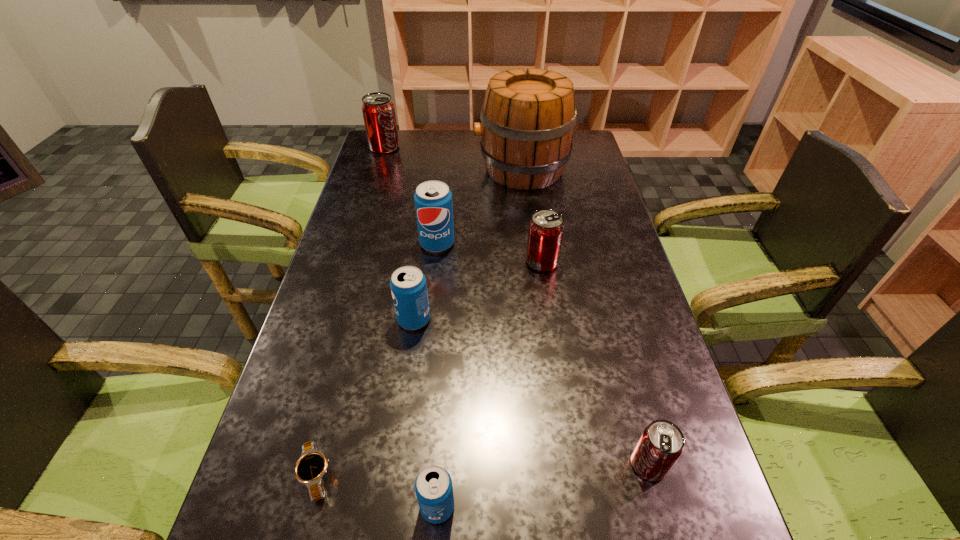
Find the location of a particular element. vacant point located on the front of the second smallest red pop soda is located at coordinates (562, 397).

Where is `free space located 0.080m on the front of the second nearest soda can`? free space located 0.080m on the front of the second nearest soda can is located at coordinates (666, 531).

This screenshot has height=540, width=960. What are the coordinates of `vacant space located on the right of the nearest blue soda can` in the screenshot? It's located at (511, 507).

What are the coordinates of `free space located 0.310m on the right of the black watch` in the screenshot? It's located at (497, 475).

Locate an element on the screen. cider located in the far edge section of the desktop is located at coordinates (528, 118).

The image size is (960, 540). Find the location of `pop soda at the far edge`. pop soda at the far edge is located at coordinates (378, 110).

This screenshot has height=540, width=960. What are the coordinates of `pop soda situated at the left edge` in the screenshot? It's located at (378, 110).

At what (x,y) coordinates should I click in order to perform the action: click on watch present at the left edge. Please return your answer as a coordinate pair (x, y). The width and height of the screenshot is (960, 540). Looking at the image, I should click on (310, 468).

At what (x,y) coordinates should I click in order to perform the action: click on cider present at the right edge. Please return your answer as a coordinate pair (x, y). Image resolution: width=960 pixels, height=540 pixels. Looking at the image, I should click on (528, 118).

Where is `pop soda that is at the right edge`? The height and width of the screenshot is (540, 960). pop soda that is at the right edge is located at coordinates (661, 444).